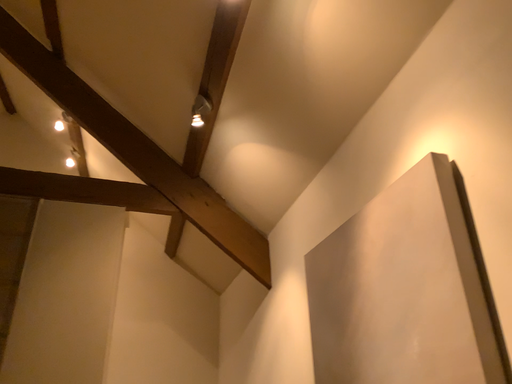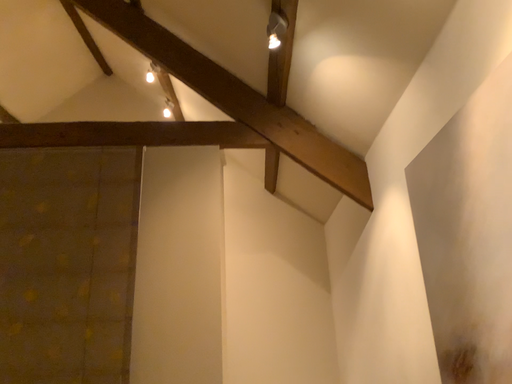
Question: Which way did the camera rotate in the video?

Choices:
 (A) rotated left
 (B) rotated right

Answer: (A)